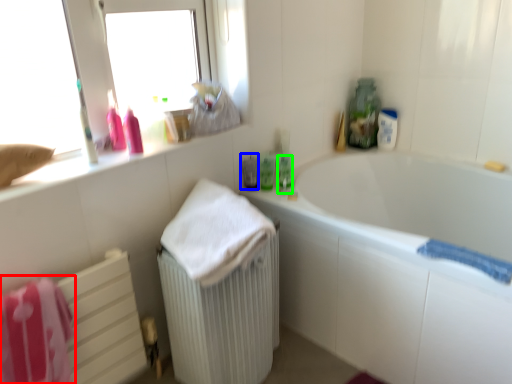
Question: Considering the real-world distances, which object is farthest from bath towel (highlighted by a red box)? mouthwash (highlighted by a blue box) or mouthwash (highlighted by a green box)?

Choices:
 (A) mouthwash
 (B) mouthwash

Answer: (B)